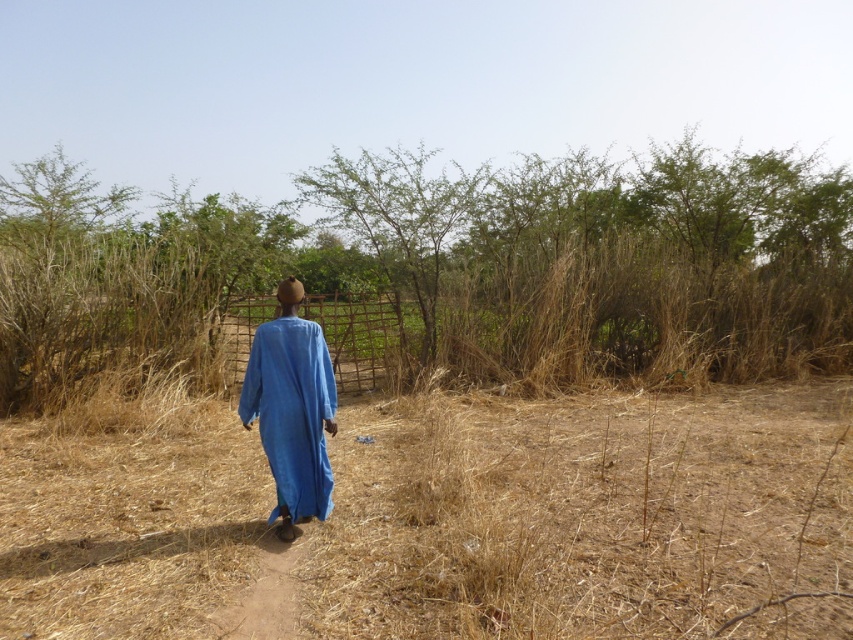
Question: Which point is farther from the camera taking this photo?

Choices:
 (A) (279, 472)
 (B) (293, 616)
 (C) (12, 362)

Answer: (C)

Question: In this image, where is blue cotton robe at center located relative to brown dirt path at center?

Choices:
 (A) above
 (B) below

Answer: (A)

Question: Does brown dry bush at center appear over blue cotton robe at center?

Choices:
 (A) no
 (B) yes

Answer: (B)

Question: Can you confirm if brown dry bush at center is positioned to the right of blue cotton robe at center?

Choices:
 (A) yes
 (B) no

Answer: (A)

Question: Which is farther from the brown dirt path at center?

Choices:
 (A) brown dry bush at center
 (B) blue cotton robe at center

Answer: (A)

Question: Which point is farther to the camera?

Choices:
 (A) brown dry bush at center
 (B) blue cotton robe at center

Answer: (A)